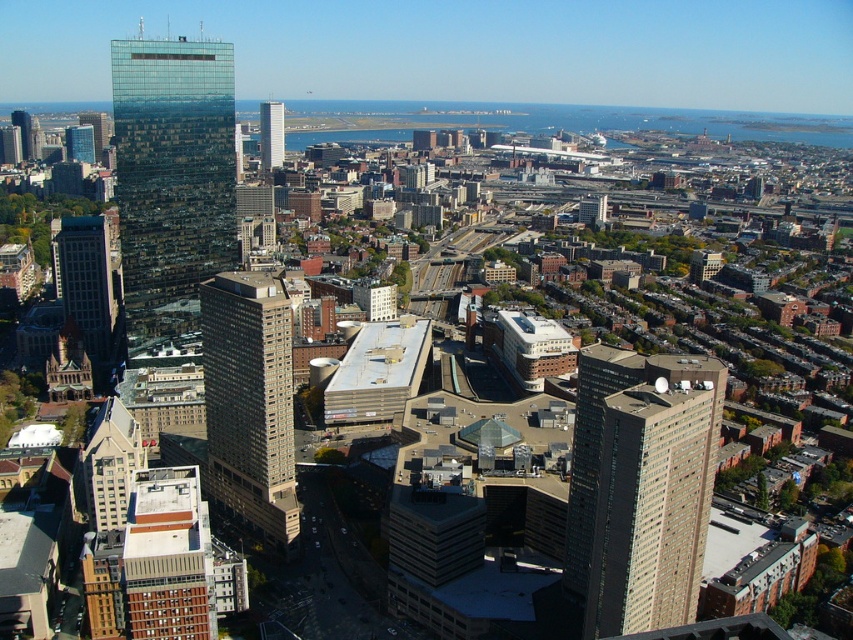
Question: Can you confirm if matte glass skyscraper at left is bigger than glassy reflective skyscraper at center?

Choices:
 (A) no
 (B) yes

Answer: (B)

Question: Can you confirm if beige concrete building at center is positioned above glassy reflective skyscraper at center?

Choices:
 (A) yes
 (B) no

Answer: (B)

Question: Which of the following is the closest to the observer?

Choices:
 (A) (103, 250)
 (B) (287, 480)
 (C) (587, 538)

Answer: (C)

Question: Which of these objects is positioned closest to the beige glass building at right?

Choices:
 (A) matte glass skyscraper at left
 (B) beige concrete building at center
 (C) glassy reflective skyscraper at center
 (D) transparent glass skyscraper at left

Answer: (B)

Question: Which object is positioned farthest from the matte glass skyscraper at left?

Choices:
 (A) beige glass building at right
 (B) transparent glass skyscraper at left
 (C) glassy reflective skyscraper at center

Answer: (C)

Question: Considering the relative positions of beige concrete building at center and matte glass skyscraper at left in the image provided, where is beige concrete building at center located with respect to matte glass skyscraper at left?

Choices:
 (A) above
 (B) below

Answer: (B)